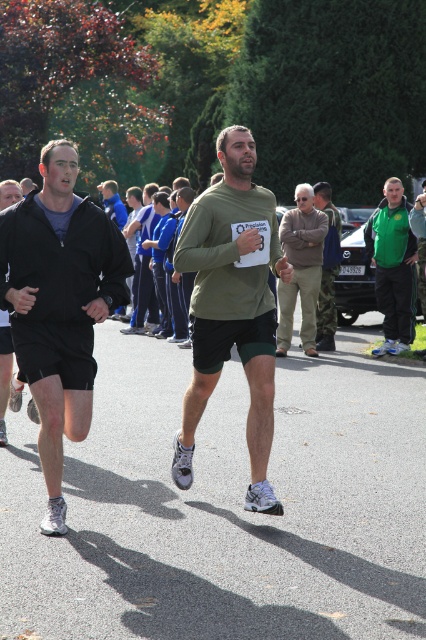
Question: Which is farther from the tan fabric jacket at center?

Choices:
 (A) green matte shirt at center
 (B) matte black jacket at left
 (C) green fabric jacket at right

Answer: (B)

Question: Which point is farther from the camera taking this photo?

Choices:
 (A) (31, 292)
 (B) (397, 237)
 (C) (322, 280)

Answer: (C)

Question: Is green fabric jacket at right wider than camouflage pants at center?

Choices:
 (A) no
 (B) yes

Answer: (B)

Question: Is green fabric jacket at right positioned before camouflage pants at center?

Choices:
 (A) yes
 (B) no

Answer: (A)

Question: Is matte black jacket at left closer to the viewer compared to camouflage pants at center?

Choices:
 (A) no
 (B) yes

Answer: (B)

Question: Which of the following is the closest to the observer?

Choices:
 (A) tan fabric jacket at center
 (B) green fabric jacket at right
 (C) matte black jacket at left
 (D) camouflage pants at center

Answer: (C)